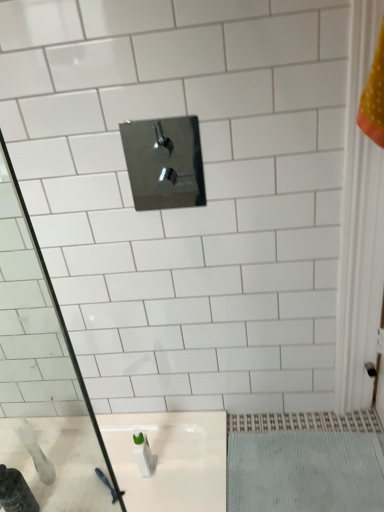
Question: Is polished chrome tap at upper center not inside white glossy bottle at lower left?

Choices:
 (A) no
 (B) yes

Answer: (B)

Question: Is polished chrome tap at upper center next to white glossy bottle at lower left and touching it?

Choices:
 (A) no
 (B) yes

Answer: (A)

Question: Is polished chrome tap at upper center facing away from white glossy bottle at lower left?

Choices:
 (A) yes
 (B) no

Answer: (B)

Question: Is white glossy bottle at lower left inside polished chrome tap at upper center?

Choices:
 (A) no
 (B) yes

Answer: (A)

Question: Does polished chrome tap at upper center appear on the left side of white glossy bottle at lower left?

Choices:
 (A) yes
 (B) no

Answer: (B)

Question: Considering the positions of white textured bath mat at lower right and white glossy bottle at lower left in the image, is white textured bath mat at lower right wider or thinner than white glossy bottle at lower left?

Choices:
 (A) wide
 (B) thin

Answer: (A)

Question: Considering the positions of white textured bath mat at lower right and white glossy bottle at lower left in the image, is white textured bath mat at lower right bigger or smaller than white glossy bottle at lower left?

Choices:
 (A) small
 (B) big

Answer: (B)

Question: In the image, is white textured bath mat at lower right positioned in front of or behind white glossy bottle at lower left?

Choices:
 (A) front
 (B) behind

Answer: (A)

Question: From the image's perspective, is white textured bath mat at lower right located above or below white glossy bottle at lower left?

Choices:
 (A) above
 (B) below

Answer: (A)

Question: Considering the positions of white glossy bottle at lower left and white textured bath mat at lower right in the image, is white glossy bottle at lower left taller or shorter than white textured bath mat at lower right?

Choices:
 (A) short
 (B) tall

Answer: (B)

Question: Which is correct: white glossy bottle at lower left is inside white textured bath mat at lower right, or outside of it?

Choices:
 (A) inside
 (B) outside

Answer: (B)

Question: Considering the positions of point (31, 502) and point (370, 439), is point (31, 502) closer or farther from the camera than point (370, 439)?

Choices:
 (A) farther
 (B) closer

Answer: (B)

Question: Is white glossy bottle at lower left to the left or to the right of white textured bath mat at lower right in the image?

Choices:
 (A) left
 (B) right

Answer: (A)

Question: Is polished chrome tap at upper center in front of or behind white textured bath mat at lower right in the image?

Choices:
 (A) front
 (B) behind

Answer: (A)

Question: Is polished chrome tap at upper center bigger or smaller than white textured bath mat at lower right?

Choices:
 (A) big
 (B) small

Answer: (B)